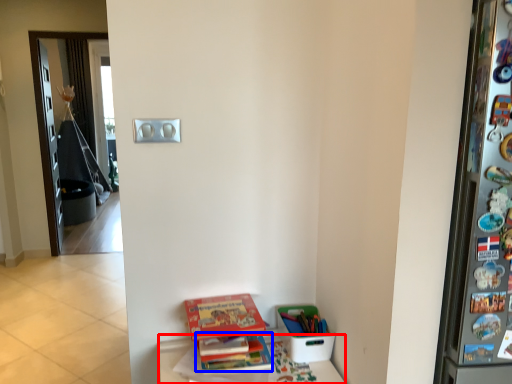
Question: Which object appears farthest to the camera in this image, furniture (highlighted by a red box) or book (highlighted by a blue box)?

Choices:
 (A) furniture
 (B) book

Answer: (B)